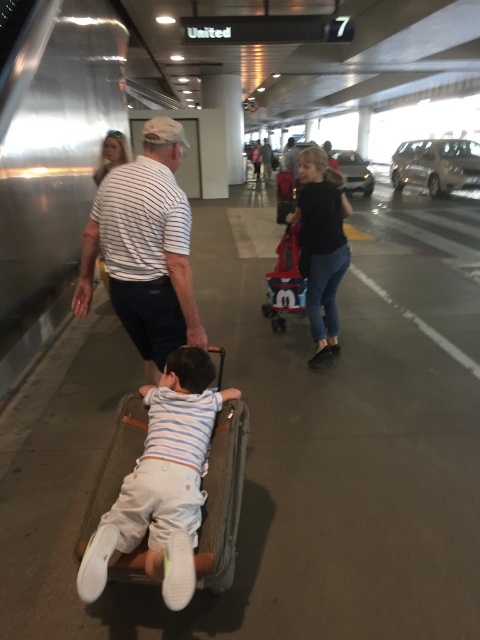
You are at the airport terminal and see a man pushing a suitcase with a young boy on top. Where is the light blue striped shirt at center positioned relative to the suitcase?

The light blue striped shirt at center is located at point (168, 481), which means it is positioned near the center of the image, slightly to the right and above the suitcase.

You are a photographer standing at the entrance of the gate area. You see a man in a white striped shirt at center and a boy in a light blue striped shirt at center. If you want to take a photo that includes both subjects without cropping either of them, what is the minimum width your camera frame needs to be?

The light blue striped shirt at center and white striped shirt at center are 25.82 inches apart. To include both subjects without cropping, the camera frame must be at least 25.82 inches wide.